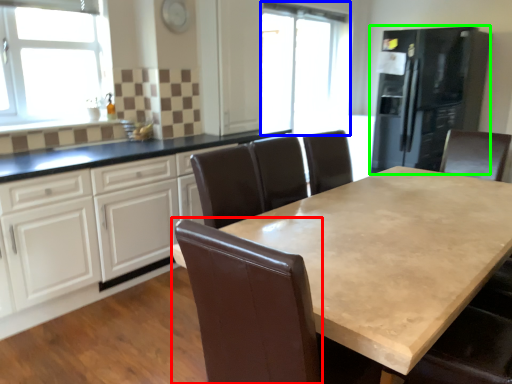
Question: Which object is positioned closest to swivel chair (highlighted by a red box)? Select from window screen (highlighted by a blue box) and fridge (highlighted by a green box).

Choices:
 (A) window screen
 (B) fridge

Answer: (B)